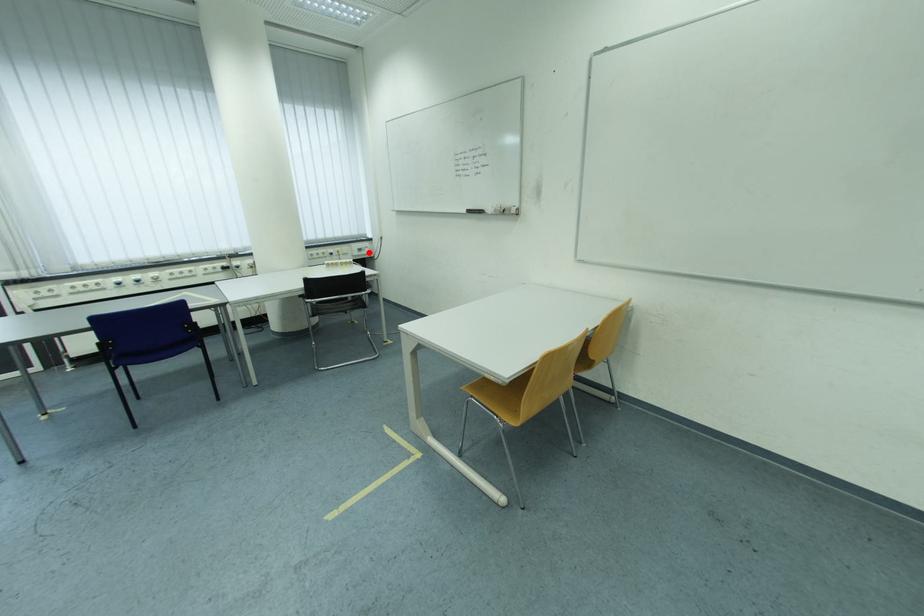
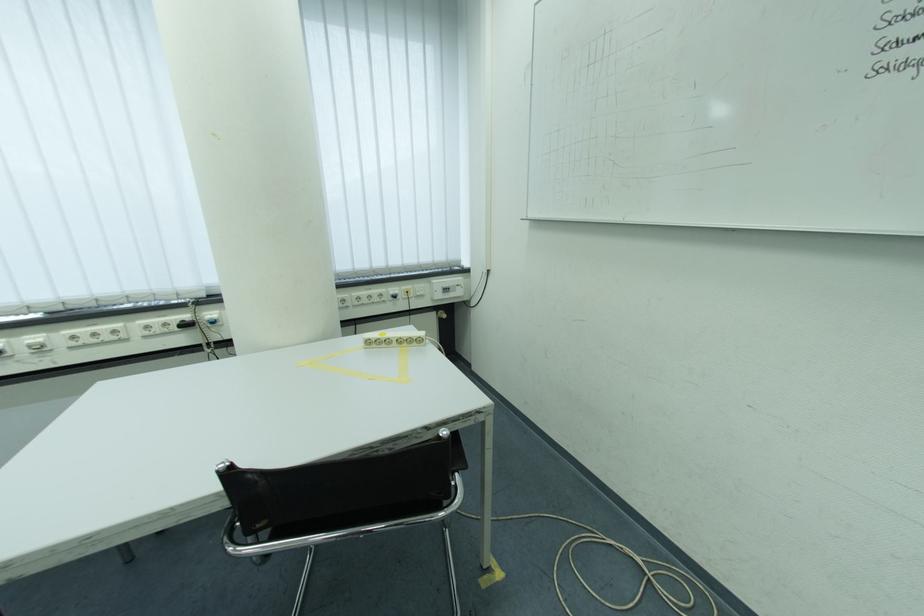
Question: A red point is marked in image1. In image2, is the corresponding 3D point closer to the camera or farther? Reply with the corresponding letter.

Choices:
 (A) The corresponding 3D point is closer.
 (B) The corresponding 3D point is farther.

Answer: (B)